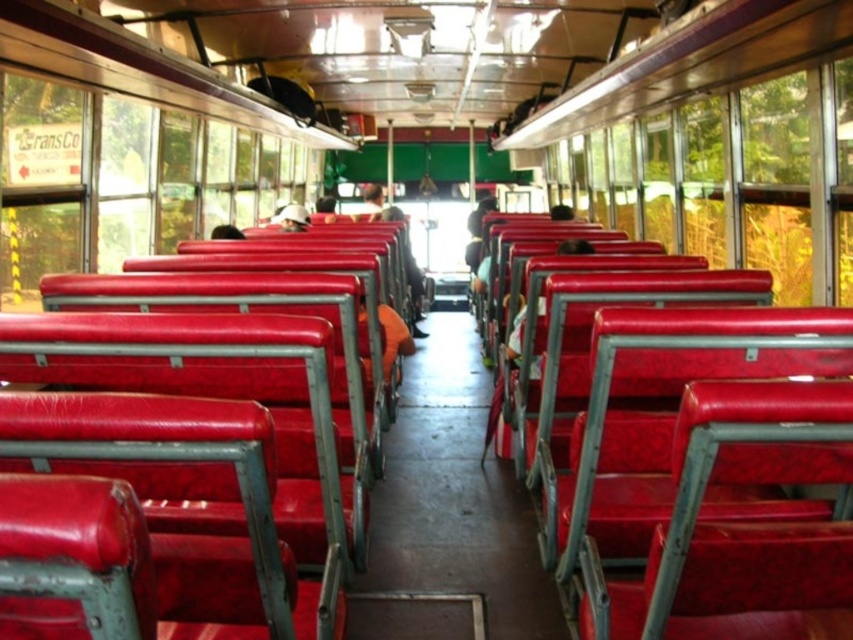
Does matte red seats at center come in front of matte red seat at center?

Yes, it is in front of matte red seat at center.

Is matte red seats at center taller than matte red seat at center?

In fact, matte red seats at center may be shorter than matte red seat at center.

Between point (62, 68) and point (378, 218), which one is positioned behind?

Point (378, 218)

Identify the location of matte red seats at center. Image resolution: width=853 pixels, height=640 pixels. (126, 147).